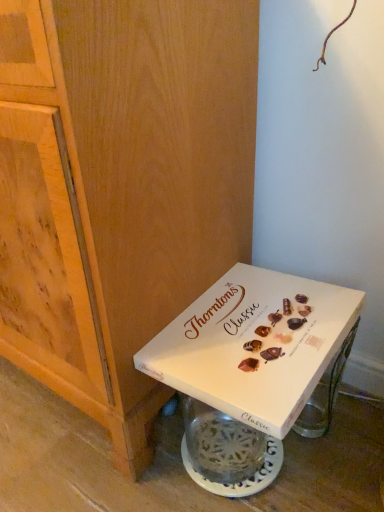
Question: Should I look upward or downward to see white cardboard box at lower right?

Choices:
 (A) up
 (B) down

Answer: (B)

Question: Is white cardboard box at lower right outside wooden cabinet at lower left?

Choices:
 (A) yes
 (B) no

Answer: (A)

Question: Does white cardboard box at lower right turn towards wooden cabinet at lower left?

Choices:
 (A) yes
 (B) no

Answer: (B)

Question: From the image's perspective, does white cardboard box at lower right appear lower than wooden cabinet at lower left?

Choices:
 (A) yes
 (B) no

Answer: (A)

Question: Considering the relative sizes of white cardboard box at lower right and wooden cabinet at lower left in the image provided, is white cardboard box at lower right bigger than wooden cabinet at lower left?

Choices:
 (A) no
 (B) yes

Answer: (A)

Question: From a real-world perspective, is white cardboard box at lower right beneath wooden cabinet at lower left?

Choices:
 (A) no
 (B) yes

Answer: (B)

Question: Can you confirm if white cardboard box at lower right is positioned to the right of wooden cabinet at lower left?

Choices:
 (A) yes
 (B) no

Answer: (A)

Question: Does wooden cabinet at lower left have a greater width compared to white cardboard box at lower right?

Choices:
 (A) yes
 (B) no

Answer: (A)

Question: Is wooden cabinet at lower left positioned with its back to white cardboard box at lower right?

Choices:
 (A) yes
 (B) no

Answer: (B)

Question: Is white cardboard box at lower right a part of wooden cabinet at lower left?

Choices:
 (A) yes
 (B) no

Answer: (B)

Question: Can you confirm if wooden cabinet at lower left is taller than white cardboard box at lower right?

Choices:
 (A) no
 (B) yes

Answer: (B)

Question: Is wooden cabinet at lower left thinner than white cardboard box at lower right?

Choices:
 (A) no
 (B) yes

Answer: (A)

Question: Is the position of wooden cabinet at lower left more distant than that of white cardboard box at lower right?

Choices:
 (A) no
 (B) yes

Answer: (A)

Question: Considering the positions of wooden cabinet at lower left and white cardboard box at lower right in the image, is wooden cabinet at lower left bigger or smaller than white cardboard box at lower right?

Choices:
 (A) big
 (B) small

Answer: (A)